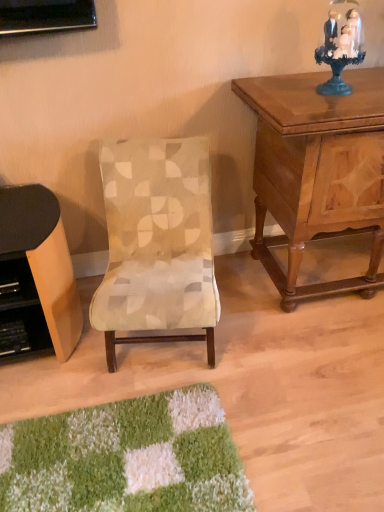
Question: Considering the relative positions of beige fabric chair at center and blue glass figurine at upper right in the image provided, is beige fabric chair at center in front of blue glass figurine at upper right?

Choices:
 (A) yes
 (B) no

Answer: (A)

Question: Can blue glass figurine at upper right be found inside beige fabric chair at center?

Choices:
 (A) yes
 (B) no

Answer: (B)

Question: Does beige fabric chair at center have a smaller size compared to blue glass figurine at upper right?

Choices:
 (A) no
 (B) yes

Answer: (A)

Question: Is beige fabric chair at center to the right of blue glass figurine at upper right from the viewer's perspective?

Choices:
 (A) yes
 (B) no

Answer: (B)

Question: Are beige fabric chair at center and blue glass figurine at upper right beside each other?

Choices:
 (A) no
 (B) yes

Answer: (A)

Question: From the image's perspective, is wooden nightstand at upper right located above or below blue glass figurine at upper right?

Choices:
 (A) above
 (B) below

Answer: (B)

Question: From a real-world perspective, relative to blue glass figurine at upper right, is wooden nightstand at upper right vertically above or below?

Choices:
 (A) above
 (B) below

Answer: (B)

Question: Is wooden nightstand at upper right wider or thinner than blue glass figurine at upper right?

Choices:
 (A) wide
 (B) thin

Answer: (A)

Question: Is wooden nightstand at upper right taller or shorter than blue glass figurine at upper right?

Choices:
 (A) tall
 (B) short

Answer: (A)

Question: From a real-world perspective, is blue glass figurine at upper right positioned above or below wooden nightstand at upper right?

Choices:
 (A) above
 (B) below

Answer: (A)

Question: In the image, is blue glass figurine at upper right on the left side or the right side of wooden nightstand at upper right?

Choices:
 (A) left
 (B) right

Answer: (A)

Question: Considering the positions of blue glass figurine at upper right and wooden nightstand at upper right in the image, is blue glass figurine at upper right wider or thinner than wooden nightstand at upper right?

Choices:
 (A) wide
 (B) thin

Answer: (B)

Question: Considering their positions, is blue glass figurine at upper right located in front of or behind wooden nightstand at upper right?

Choices:
 (A) front
 (B) behind

Answer: (B)

Question: Is blue glass figurine at upper right spatially inside beige fabric chair at center, or outside of it?

Choices:
 (A) outside
 (B) inside

Answer: (A)

Question: From the image's perspective, relative to beige fabric chair at center, is blue glass figurine at upper right above or below?

Choices:
 (A) above
 (B) below

Answer: (A)